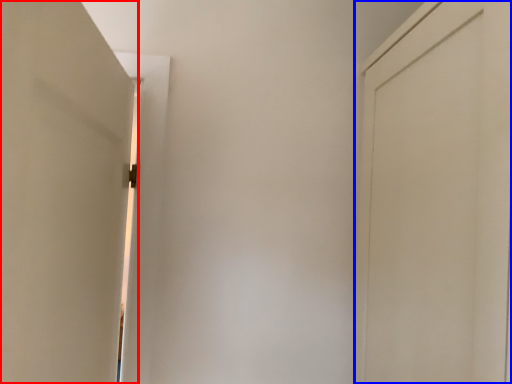
Question: Among these objects, which one is farthest to the camera, door (highlighted by a red box) or door (highlighted by a blue box)?

Choices:
 (A) door
 (B) door

Answer: (B)